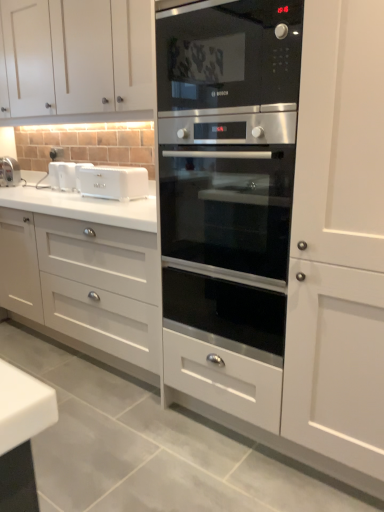
Question: Is stainless steel oven at center oriented towards white matte cabinet at upper left?

Choices:
 (A) yes
 (B) no

Answer: (B)

Question: From the image's perspective, would you say stainless steel oven at center is shown under white matte cabinet at upper left?

Choices:
 (A) no
 (B) yes

Answer: (B)

Question: Can you confirm if stainless steel oven at center is taller than white matte cabinet at upper left?

Choices:
 (A) yes
 (B) no

Answer: (B)

Question: Is stainless steel oven at center positioned in front of white matte cabinet at upper left?

Choices:
 (A) no
 (B) yes

Answer: (B)

Question: From a real-world perspective, is stainless steel oven at center physically above white matte cabinet at upper left?

Choices:
 (A) no
 (B) yes

Answer: (A)

Question: Looking at their shapes, would you say matte white faucet at left is wider or thinner than white matte cabinet at upper left?

Choices:
 (A) wide
 (B) thin

Answer: (B)

Question: Considering the positions of point (6, 176) and point (109, 65), is point (6, 176) closer or farther from the camera than point (109, 65)?

Choices:
 (A) farther
 (B) closer

Answer: (A)

Question: Based on their positions, is matte white faucet at left located to the left or right of white matte cabinet at upper left?

Choices:
 (A) left
 (B) right

Answer: (A)

Question: From the image's perspective, is matte white faucet at left above or below white matte cabinet at upper left?

Choices:
 (A) above
 (B) below

Answer: (B)

Question: Considering the positions of white plastic toaster at center, the 2th appliance viewed from the left, and white matte cabinet at upper left in the image, is white plastic toaster at center, the 2th appliance viewed from the left, wider or thinner than white matte cabinet at upper left?

Choices:
 (A) wide
 (B) thin

Answer: (B)

Question: Is white plastic toaster at center, marked as the first appliance in a right-to-left arrangement, taller or shorter than white matte cabinet at upper left?

Choices:
 (A) tall
 (B) short

Answer: (B)

Question: From a real-world perspective, is white plastic toaster at center, the 2th appliance viewed from the left, physically located above or below white matte cabinet at upper left?

Choices:
 (A) below
 (B) above

Answer: (A)

Question: In terms of size, does white plastic toaster at center, marked as the first appliance in a right-to-left arrangement, appear bigger or smaller than white matte cabinet at upper left?

Choices:
 (A) big
 (B) small

Answer: (B)

Question: Looking at their shapes, would you say black glass microwave at center is wider or thinner than white plastic toaster at center, marked as the first appliance in a right-to-left arrangement?

Choices:
 (A) wide
 (B) thin

Answer: (A)

Question: From their relative heights in the image, would you say black glass microwave at center is taller or shorter than white plastic toaster at center, the 2th appliance viewed from the left?

Choices:
 (A) tall
 (B) short

Answer: (A)